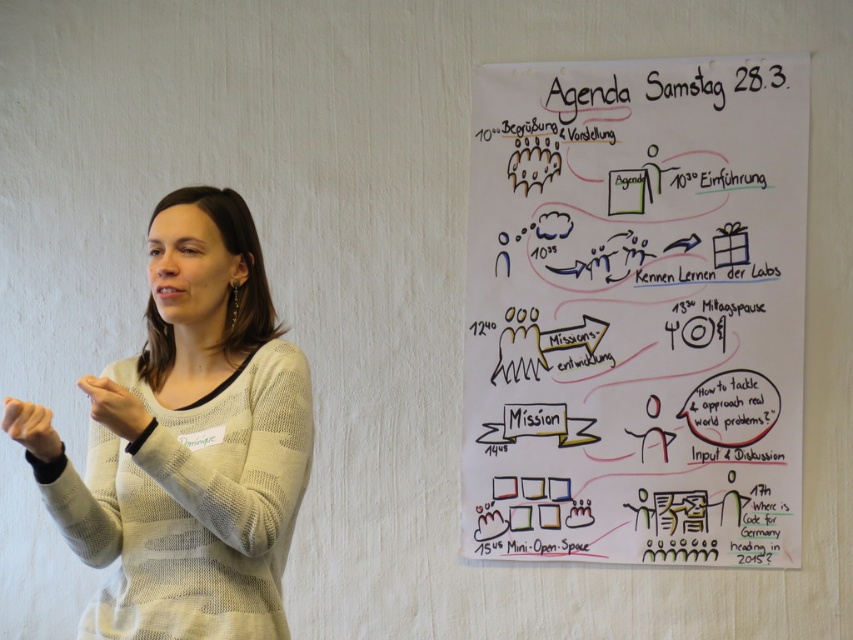
Which is in front, point (44, 490) or point (131, 419)?

Point (131, 419)

Which is in front, point (164, 202) or point (93, 408)?

Point (93, 408) is in front.

Where is `white knitted sweater at center`? The image size is (853, 640). white knitted sweater at center is located at coordinates point(195,444).

Is white paper at upper right taller than white knitted sweater at center?

Correct, white paper at upper right is much taller as white knitted sweater at center.

Can you confirm if white paper at upper right is positioned to the left of white knitted sweater at center?

Incorrect, white paper at upper right is not on the left side of white knitted sweater at center.

Identify the location of white paper at upper right. (636, 310).

Identify the location of white paper at upper right. (636, 310).

Between white knitted sweater at center and matte white hand at lower left, which one is positioned higher?

white knitted sweater at center is higher up.

Is white knitted sweater at center positioned before matte white hand at lower left?

No, it is behind matte white hand at lower left.

What do you see at coordinates (195, 444) in the screenshot?
I see `white knitted sweater at center` at bounding box center [195, 444].

In order to click on white knitted sweater at center in this screenshot , I will do `click(195, 444)`.